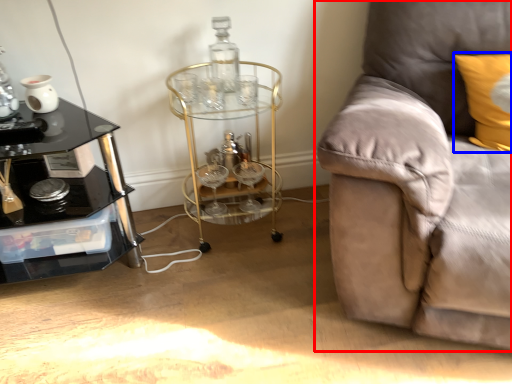
Question: Which object appears farthest to the camera in this image, studio couch (highlighted by a red box) or pillow (highlighted by a blue box)?

Choices:
 (A) studio couch
 (B) pillow

Answer: (B)